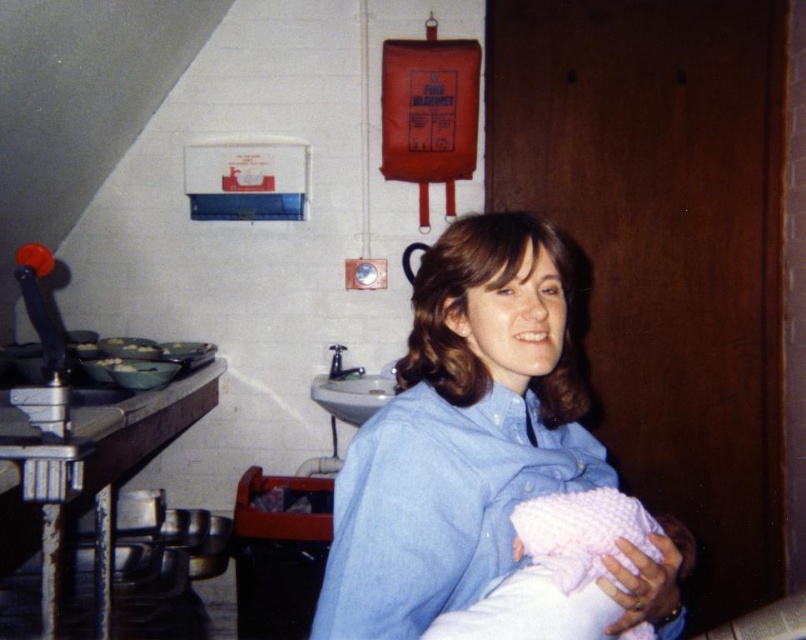
Question: Which point appears closest to the camera in this image?

Choices:
 (A) (403, 579)
 (B) (615, 582)

Answer: (B)

Question: Is blue cotton shirt at center below pink knitted blanket at lower center?

Choices:
 (A) yes
 (B) no

Answer: (B)

Question: Which of the following is the farthest from the observer?

Choices:
 (A) (596, 529)
 (B) (451, 417)

Answer: (B)

Question: Can you confirm if blue cotton shirt at center is thinner than pink knitted blanket at lower center?

Choices:
 (A) yes
 (B) no

Answer: (B)

Question: Where is blue cotton shirt at center located in relation to pink knitted blanket at lower center in the image?

Choices:
 (A) right
 (B) left

Answer: (B)